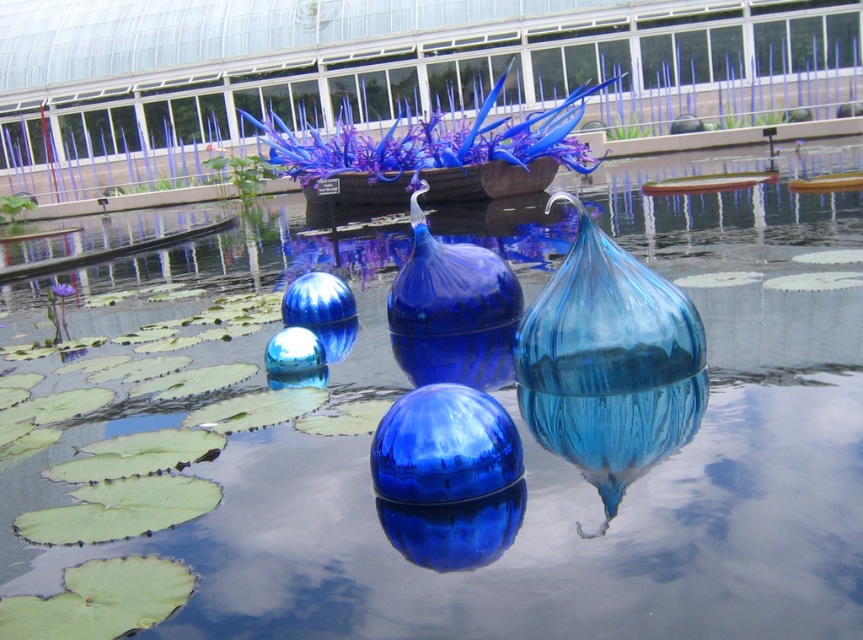
Question: Does blue glass vase at center have a lesser width compared to glossy blue glass vase at center?

Choices:
 (A) yes
 (B) no

Answer: (A)

Question: Which of the following is the closest to the observer?

Choices:
 (A) (454, 291)
 (B) (587, 362)

Answer: (B)

Question: Is blue glass vase at center thinner than glossy blue glass vase at center?

Choices:
 (A) no
 (B) yes

Answer: (B)

Question: Where is blue glass vase at center located in relation to glossy blue glass vase at center in the image?

Choices:
 (A) above
 (B) below

Answer: (B)

Question: Which point is farther to the camera?

Choices:
 (A) glossy blue glass vase at center
 (B) blue glass vase at center

Answer: (A)